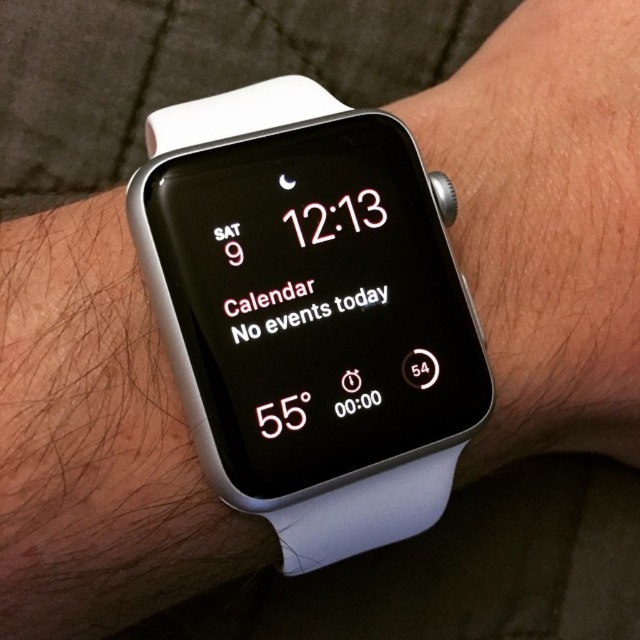
In the scene shown: Can you confirm if white plastic watch at center is positioned below white rubber watch at center?

Yes, white plastic watch at center is below white rubber watch at center.

Measure the distance between white plastic watch at center and camera.

white plastic watch at center is 29.44 inches from camera.

You are a GUI agent. You are given a task and a screenshot of the screen. Output one action in this format:
    pyautogui.click(x=<x>, y=<y>)
    Task: Click on the white plastic watch at center
    
    Given the screenshot: What is the action you would take?
    pyautogui.click(x=310, y=312)